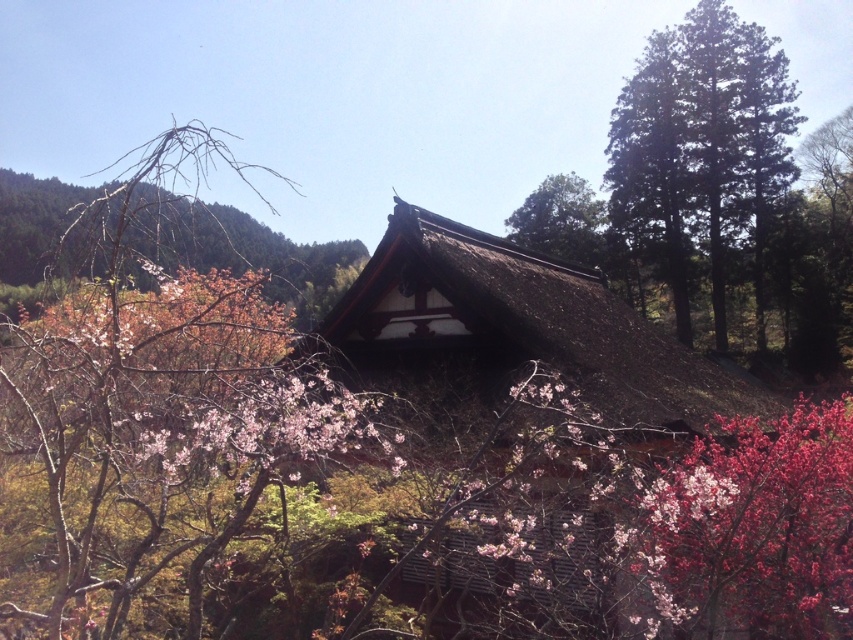
Question: Considering the relative positions of brown thatched roof at center and green textured pine trees at upper right in the image provided, where is brown thatched roof at center located with respect to green textured pine trees at upper right?

Choices:
 (A) below
 (B) above

Answer: (A)

Question: Estimate the real-world distances between objects in this image. Which object is closer to the pink matte flower at center?

Choices:
 (A) green textured pine trees at upper right
 (B) bare branches at left

Answer: (B)

Question: From the image, what is the correct spatial relationship of brown thatched roof at center in relation to green leafy tree at upper center?

Choices:
 (A) right
 (B) left

Answer: (B)

Question: Based on their relative distances, which object is nearer to the green leafy tree at upper center?

Choices:
 (A) bare branches at left
 (B) brown thatched roof at center

Answer: (A)

Question: Does brown thatched roof at center appear under green leafy tree at upper center?

Choices:
 (A) yes
 (B) no

Answer: (A)

Question: Which object is farther from the camera taking this photo?

Choices:
 (A) bare branches at left
 (B) pink matte flower at center
 (C) green textured pine trees at upper right

Answer: (C)